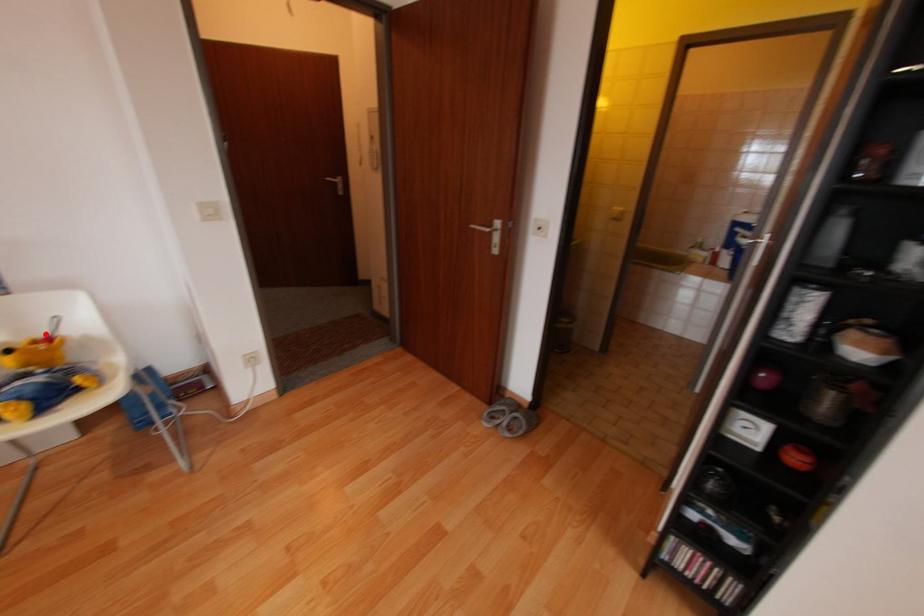
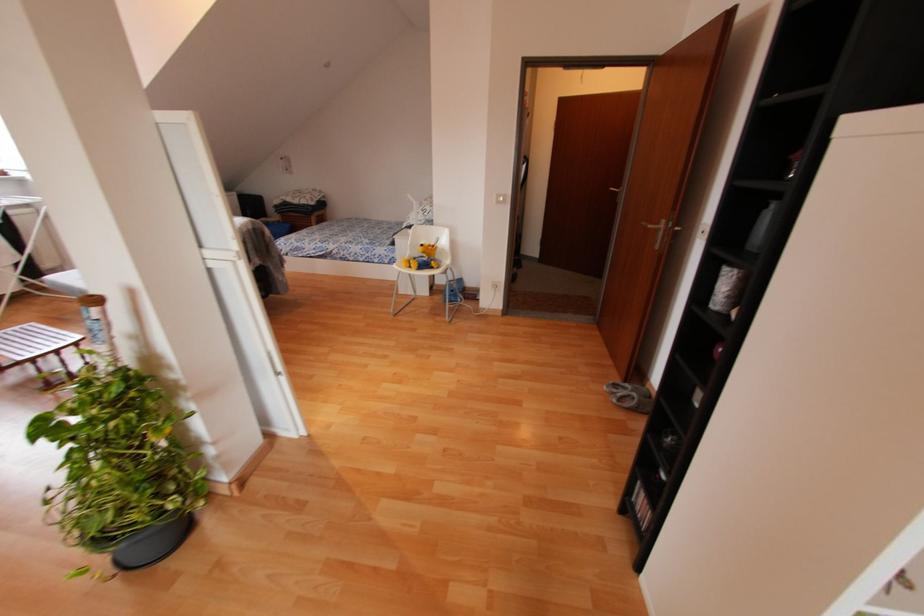
Find the pixel in the second image that matches the highlighted location in the first image.

(432, 244)